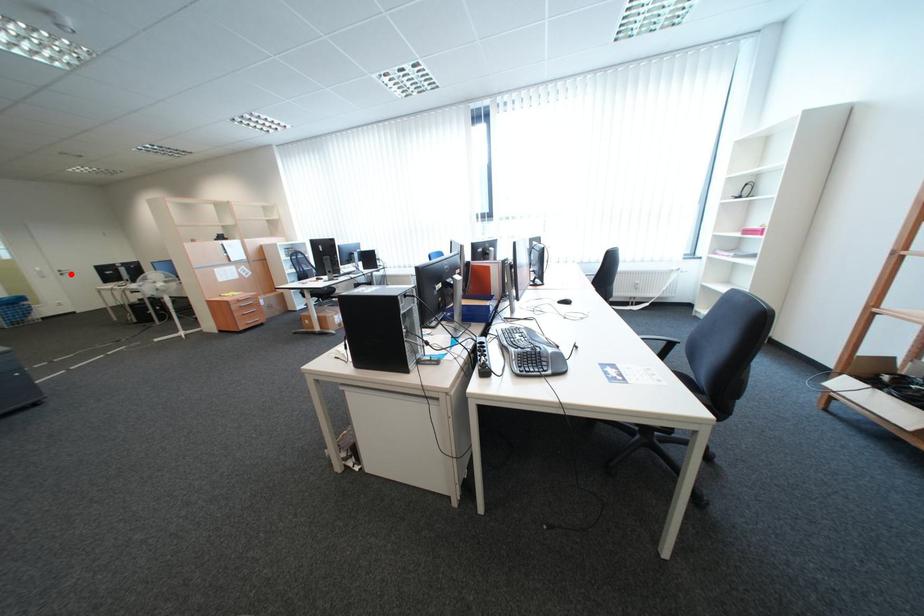
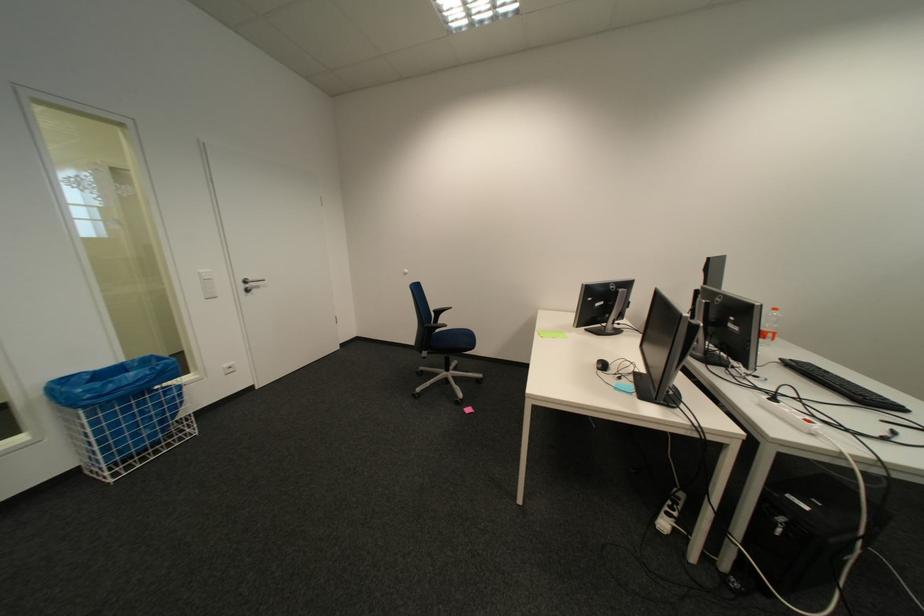
Question: I am providing you with two images of the same scene from different viewpoints. Image1 has a red point marked. In image2, the corresponding 3D location appears at what relative position? Reply with the corresponding letter.

Choices:
 (A) Closer
 (B) Farther

Answer: (A)